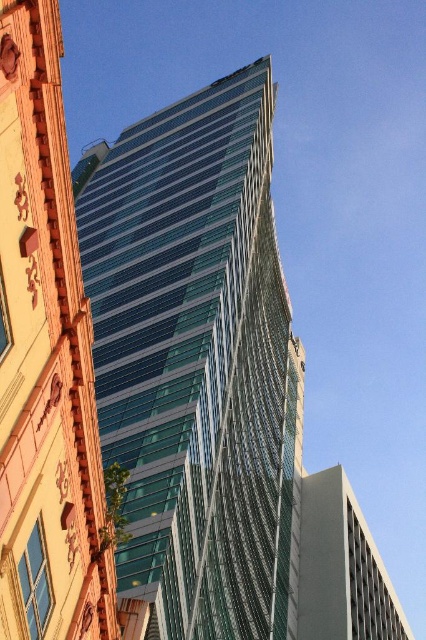
Question: Among these points, which one is farthest from the camera?

Choices:
 (A) (236, 257)
 (B) (19, 74)

Answer: (A)

Question: Which of the following is the farthest from the observer?

Choices:
 (A) (60, 227)
 (B) (181, 324)

Answer: (B)

Question: Is transparent glass tower at center to the right of transparent glass building at upper center from the viewer's perspective?

Choices:
 (A) yes
 (B) no

Answer: (A)

Question: Does transparent glass tower at center have a lesser width compared to transparent glass building at upper center?

Choices:
 (A) yes
 (B) no

Answer: (B)

Question: Does transparent glass tower at center appear over transparent glass building at upper center?

Choices:
 (A) yes
 (B) no

Answer: (A)